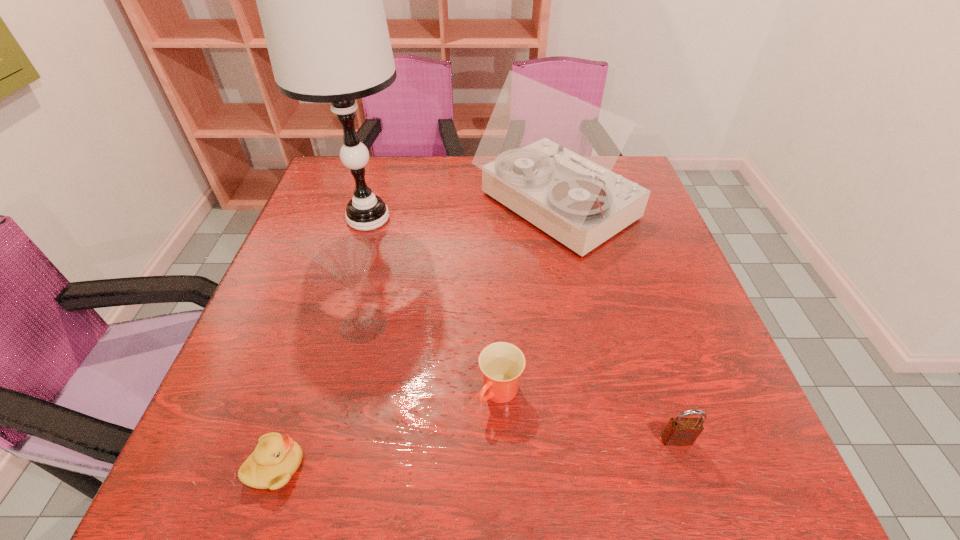
Locate an element on the screen. vacant region located on the right of the fourth farthest object is located at coordinates (711, 393).

You are a GUI agent. You are given a task and a screenshot of the screen. Output one action in this format:
    pyautogui.click(x=<x>, y=<y>)
    Task: Click on the vacant space situated 0.080m on the beak of the duckling
    The image size is (960, 540).
    Given the screenshot: What is the action you would take?
    pyautogui.click(x=352, y=466)

At what (x,y) coordinates should I click in order to perform the action: click on table lamp at the far edge. Please return your answer as a coordinate pair (x, y). Looking at the image, I should click on (320, 0).

This screenshot has height=540, width=960. Find the location of `record player at the far edge`. record player at the far edge is located at coordinates (546, 155).

Find the location of `padlock at the near edge`. padlock at the near edge is located at coordinates tap(679, 431).

Find the location of a particular element. duckling that is at the near edge is located at coordinates (276, 458).

The height and width of the screenshot is (540, 960). Find the location of `table lamp that is at the left edge`. table lamp that is at the left edge is located at coordinates (320, 0).

Image resolution: width=960 pixels, height=540 pixels. Find the location of `duckling present at the left edge`. duckling present at the left edge is located at coordinates (276, 458).

Where is `record player located in the right edge section of the desktop`? record player located in the right edge section of the desktop is located at coordinates click(546, 155).

Identify the location of padlock situated at the right edge. The image size is (960, 540). (679, 431).